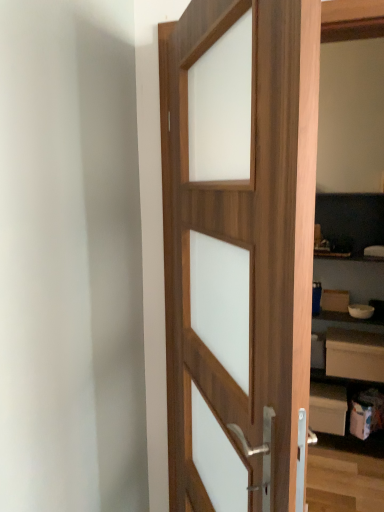
Question: From a real-world perspective, relative to white matte drawer at lower right, is white matte bookshelf at right vertically above or below?

Choices:
 (A) below
 (B) above

Answer: (B)

Question: In the image, is white matte bookshelf at right positioned in front of or behind white matte drawer at lower right?

Choices:
 (A) behind
 (B) front

Answer: (B)

Question: Which object is the closest to the wooden door at center?

Choices:
 (A) white matte drawer at lower right
 (B) white matte bookshelf at right

Answer: (B)

Question: Estimate the real-world distances between objects in this image. Which object is farther from the white matte bookshelf at right?

Choices:
 (A) white matte drawer at lower right
 (B) wooden door at center

Answer: (B)